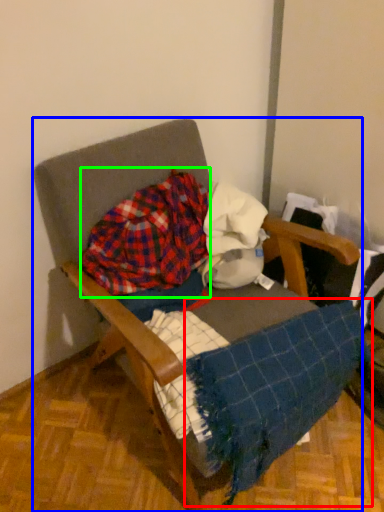
Question: Which is nearer to the blanket (highlighted by a red box)? furniture (highlighted by a blue box) or flannel (highlighted by a green box).

Choices:
 (A) furniture
 (B) flannel

Answer: (A)